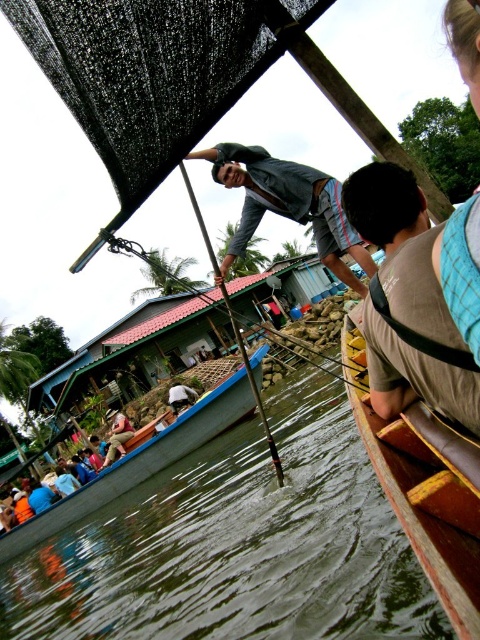
Question: Observing the image, what is the correct spatial positioning of wooden boat at center in reference to light brown wooden boat at lower left?

Choices:
 (A) left
 (B) right

Answer: (B)

Question: Is wooden pole at center bigger than light brown wooden boat at lower left?

Choices:
 (A) no
 (B) yes

Answer: (B)

Question: Which point is farther to the camera?

Choices:
 (A) (204, 396)
 (B) (278, 458)
 (C) (70, 561)
 (D) (435, 388)

Answer: (A)

Question: Does wooden canoe at center have a lesser width compared to wooden pole at center?

Choices:
 (A) no
 (B) yes

Answer: (B)

Question: Which of these objects is positioned closest to the brown cotton shirt at right?

Choices:
 (A) wooden boat at center
 (B) wooden pole at center
 (C) light brown wooden boat at lower left

Answer: (B)

Question: Which point appears farthest from the camera in this image?

Choices:
 (A) (175, 390)
 (B) (382, 449)

Answer: (A)